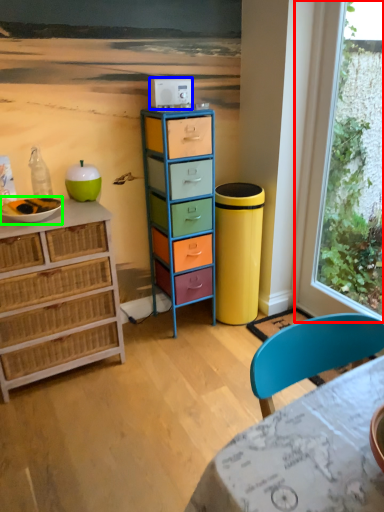
Question: Which object is positioned closest to window (highlighted by a red box)? Select from appliance (highlighted by a blue box) and bowl (highlighted by a green box).

Choices:
 (A) appliance
 (B) bowl

Answer: (A)